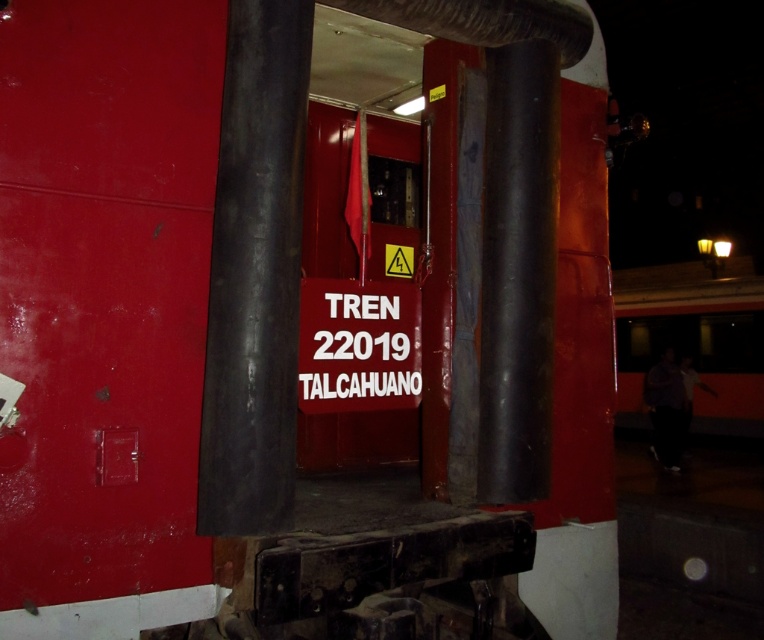
Which of these two, smooth black pole at center or white plastic sign at center, stands taller?

smooth black pole at center

Can you confirm if smooth black pole at center is positioned below white plastic sign at center?

Actually, smooth black pole at center is above white plastic sign at center.

Is point (270, 202) positioned in front of point (306, 304)?

Yes, point (270, 202) is closer to viewer.

Find the location of a particular element. Image resolution: width=764 pixels, height=640 pixels. smooth black pole at center is located at coordinates (254, 273).